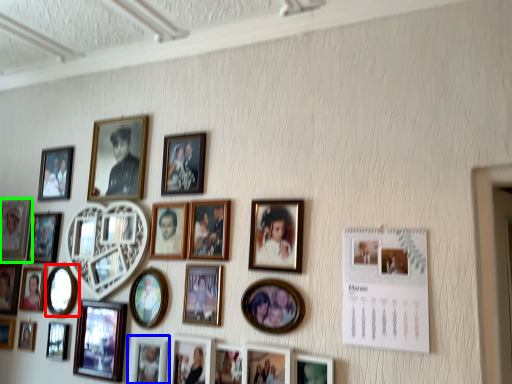
Question: Which object is the farthest from picture frame (highlighted by a red box)? Choose among these: picture frame (highlighted by a blue box) or picture frame (highlighted by a green box).

Choices:
 (A) picture frame
 (B) picture frame

Answer: (A)